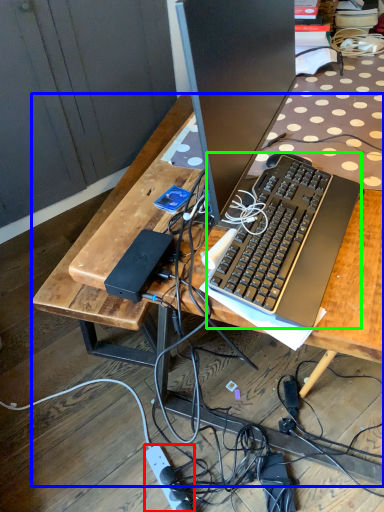
Question: Estimate the real-world distances between objects in this image. Which object is farther from power outlet (highlighted by a red box), desk (highlighted by a blue box) or computer keyboard (highlighted by a green box)?

Choices:
 (A) desk
 (B) computer keyboard

Answer: (B)